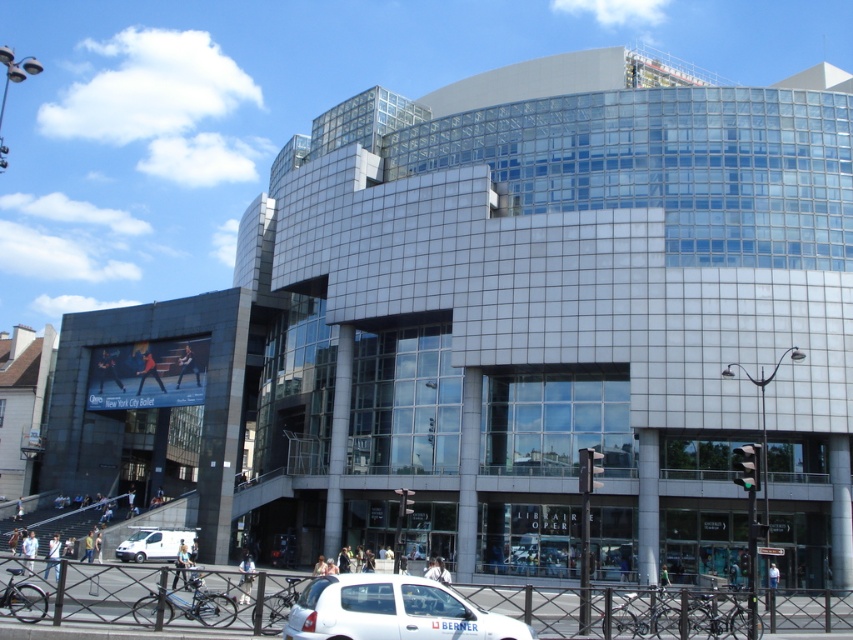
You are a delivery driver who needs to park your white matte car at lower center in a parking spot that is 25 meters away from the entrance. According to the image, can your car fit in the parking spot?

The white matte car at lower center is 24.77 meters from the camera, so it is within the 25 meters distance required for the parking spot. Therefore, the car can fit in the parking spot.

You are standing in front of the modern architectural structure and want to determine the relative positions of two points marked on the building. Which point is closer to you, point 1 at coordinates (335, 582) or point 2 at coordinates (119, 552)?

Point 1 at coordinates (335, 582) is closer to you than point 2 at coordinates (119, 552).